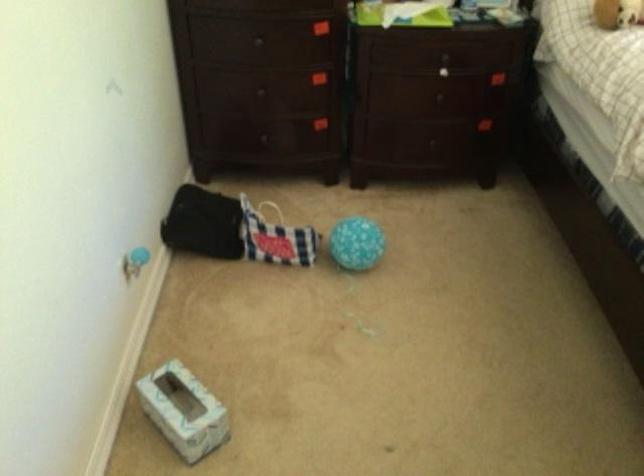
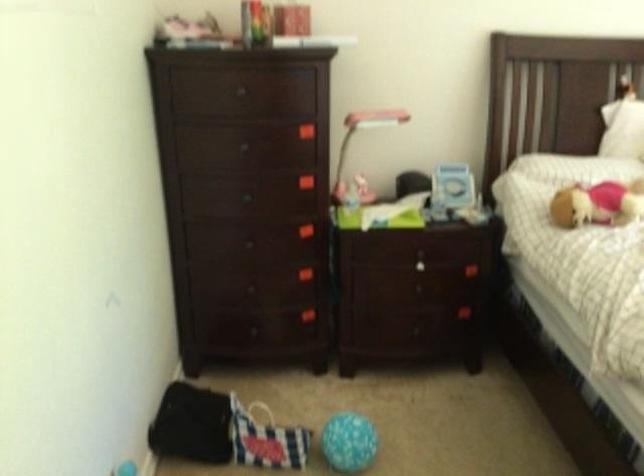
What movement of the cameraman would produce the second image?

The cameraman walked toward left, backward.